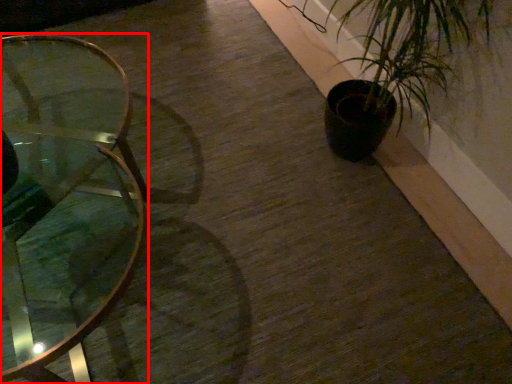
Question: From the image's perspective, what is the correct spatial positioning of table (annotated by the red box) in reference to houseplant?

Choices:
 (A) below
 (B) above

Answer: (A)